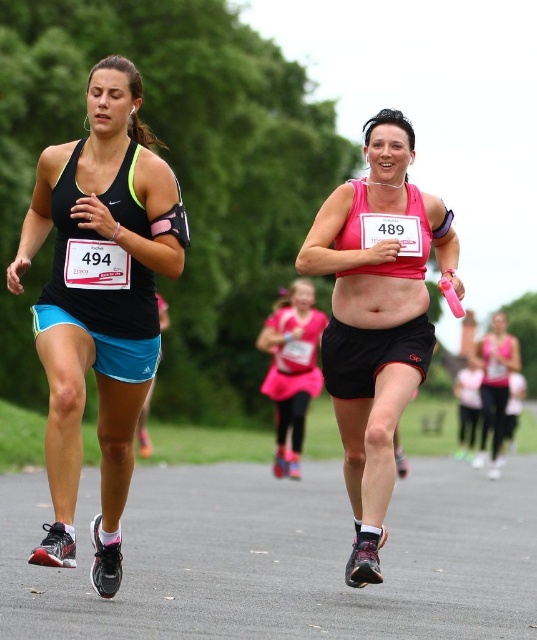
You are a GUI agent. You are given a task and a screenshot of the screen. Output one action in this format:
    pyautogui.click(x=<x>, y=<y>)
    Task: Click on the pink matte tank top at center
    The height and width of the screenshot is (640, 537).
    Given the screenshot: What is the action you would take?
    pyautogui.click(x=376, y=316)

Is pink matte tank top at center closer to camera compared to matte pink belly at center?

Yes, it is.

Is point (386, 344) in front of point (332, 300)?

Yes, point (386, 344) is closer to viewer.

Identify the location of pink matte tank top at center. This screenshot has height=640, width=537. (376, 316).

Does point (137, 216) lie in front of point (395, 273)?

Yes, it is in front of point (395, 273).

Is the position of black matte tank top at left less distant than that of pink matte tank top at center?

Yes.

Describe the element at coordinates (99, 300) in the screenshot. This screenshot has width=537, height=640. I see `black matte tank top at left` at that location.

Locate an element on the screen. This screenshot has height=640, width=537. black matte tank top at left is located at coordinates (99, 300).

Is black matte tank top at left smaller than matte pink belly at center?

No.

Is point (149, 260) positioned in front of point (378, 305)?

Yes, point (149, 260) is in front of point (378, 305).

Find the location of a particular element. black matte tank top at left is located at coordinates (99, 300).